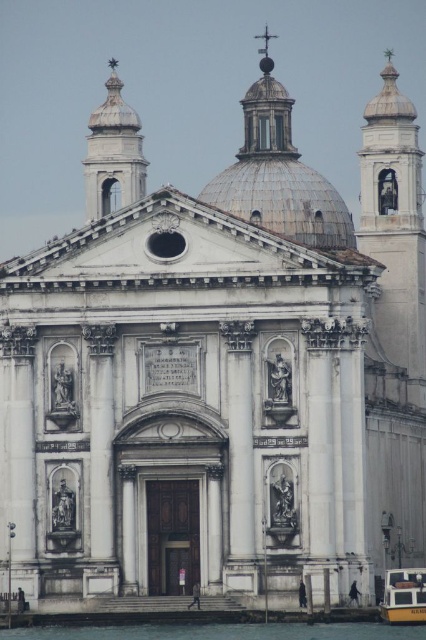
This screenshot has width=426, height=640. What do you see at coordinates (221, 632) in the screenshot?
I see `transparent water at lower center` at bounding box center [221, 632].

In order to click on transparent water at lower center in this screenshot , I will do `click(221, 632)`.